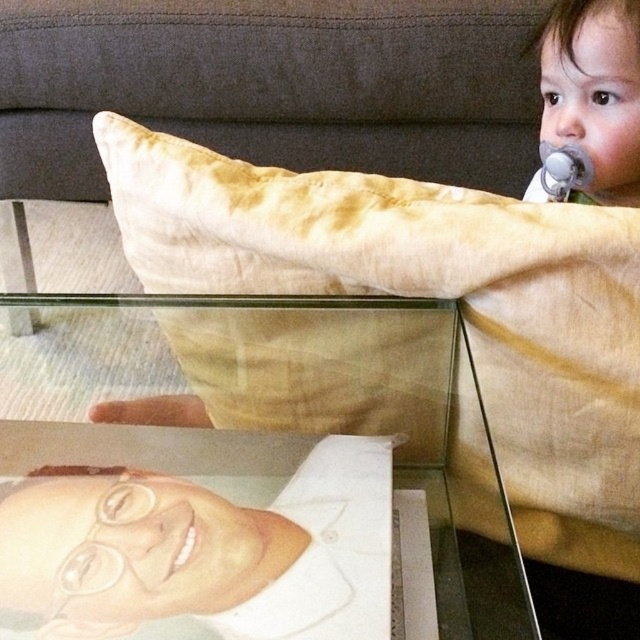
You are a photographer trying to capture a clear shot of the smooth skin toddler at upper right and the white matte mouth at lower center. Which object should you focus on first to ensure both are in focus?

You should focus on the smooth skin toddler at upper right first because it is closer to the viewer than the white matte mouth at lower center. By focusing on the closer object, the farther one may still be in the depth of field, ensuring both are sharp.

You are a photographer trying to capture the reflection of the beige cotton pillow at upper center in the glass table. The reflection is at point (432, 296). Where should you position your camera to ensure the reflection is visible in the photo?

To capture the reflection of the beige cotton pillow at upper center at point (432, 296), position the camera directly above or aligned with that point to ensure the reflection is visible in the glass table.

You are a photographer trying to capture a clear shot of the transparent glass portrait at lower left. However, the beige cotton pillow at upper center is blocking your view. Can you move the pillow to the side to get a better angle?

The transparent glass portrait at lower left is behind the beige cotton pillow at upper center, so moving the pillow aside would allow you to see the portrait clearly.